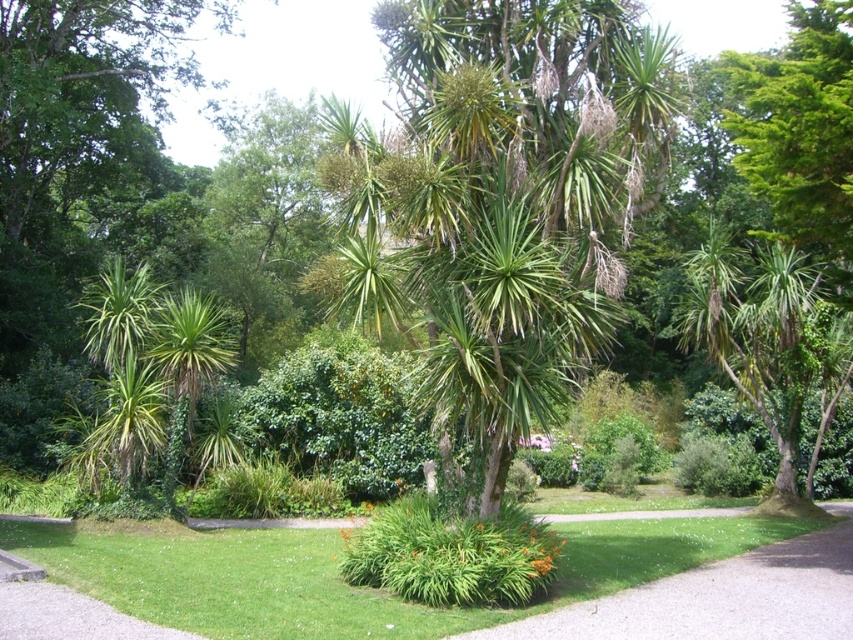
You are a gardener who wants to plant a new tree in this garden. The new tree requires at least 3 meters of space to grow. Based on the image, can you determine if there is enough space between the green leafy palm tree at center and the green grass at lower center to accommodate the new tree?

The green leafy palm tree at center is larger than the green grass at lower center, but the exact distance between them isn not specified. However, since the palm tree is at the center and the grass is at the lower center, there might be sufficient space for the new tree. Further measurement would be needed to confirm if it meets the 3 meters requirement.

You are a gardener who needs to water both the green leafy palm tree at center and the green leafy bush at center. Your watering can holds enough water to cover 10 meters of distance. If you start at the palm tree, can you reach the bush without refilling your can?

The green leafy palm tree at center and green leafy bush at center are 8.82 meters apart from each other. Since the watering can can cover 10 meters, you can water both without needing to refill.